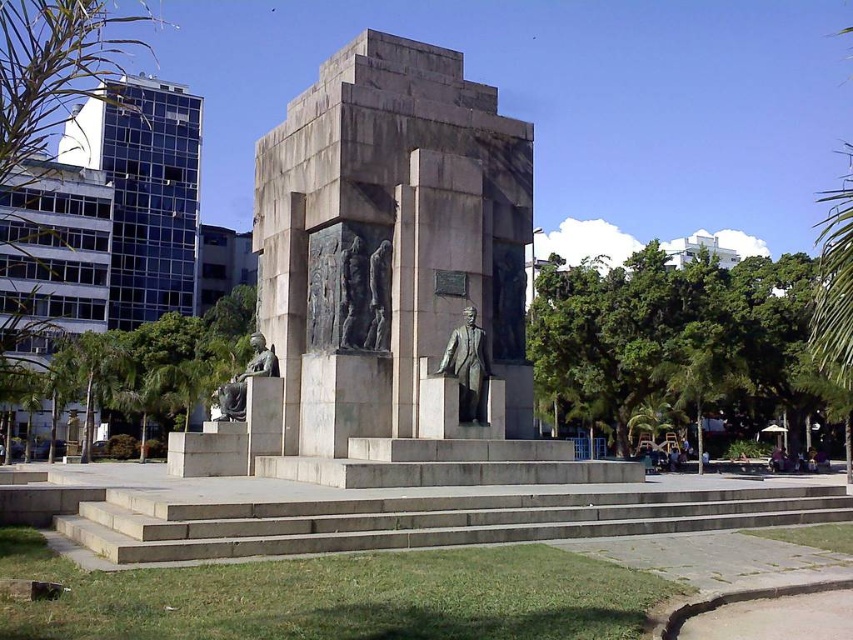
Question: Can you confirm if gray concrete stairs at center is thinner than green leafy palm tree at lower left?

Choices:
 (A) no
 (B) yes

Answer: (A)

Question: Which of the following is the closest to the observer?

Choices:
 (A) green leafy palm tree at lower left
 (B) bronze sculpture at center
 (C) bronze statue at lower left

Answer: (B)

Question: Which point is farther from the camera taking this photo?

Choices:
 (A) (111, 368)
 (B) (741, 387)

Answer: (B)

Question: Can you confirm if gray concrete stairs at center is wider than black stone relief at center?

Choices:
 (A) yes
 (B) no

Answer: (A)

Question: Is gray concrete stairs at center positioned in front of bronze statue at center?

Choices:
 (A) yes
 (B) no

Answer: (A)

Question: Which object is closer to the camera taking this photo?

Choices:
 (A) green leafy palm tree at right
 (B) bronze statue at center
 (C) gray concrete stairs at center

Answer: (C)